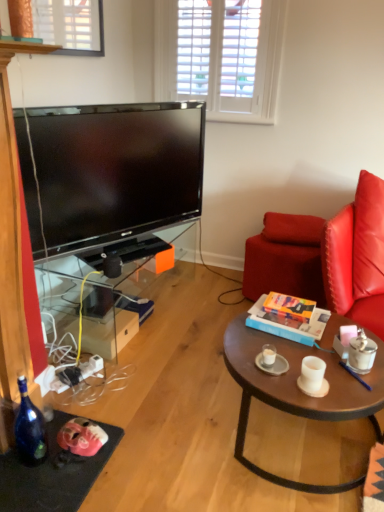
This screenshot has height=512, width=384. What do you see at coordinates (112, 265) in the screenshot?
I see `black matte speaker at lower left` at bounding box center [112, 265].

The image size is (384, 512). In order to click on black plastic pen at center in this screenshot , I will do `click(355, 375)`.

Image resolution: width=384 pixels, height=512 pixels. What do you see at coordinates (355, 375) in the screenshot?
I see `black plastic pen at center` at bounding box center [355, 375].

Image resolution: width=384 pixels, height=512 pixels. Find the location of `metallic silver coffee cup at right, placed as the 3th coffee cup when sorted from left to right`. metallic silver coffee cup at right, placed as the 3th coffee cup when sorted from left to right is located at coordinates (361, 354).

Measure the distance between leather swivel chair at right and camera.

leather swivel chair at right and camera are 7.50 feet apart.

This screenshot has height=512, width=384. What do you see at coordinates (285, 258) in the screenshot?
I see `leather swivel chair at right` at bounding box center [285, 258].

How much space does white matte coffee cup at center, acting as the 1th coffee cup starting from the left, occupy horizontally?

2.20 inches.

Find the location of a particular element. The height and width of the screenshot is (512, 384). white matte coffee cup at center, the third coffee cup positioned from the right is located at coordinates (269, 354).

The height and width of the screenshot is (512, 384). In order to click on transparent glass tv stand at left in this screenshot , I will do `click(107, 292)`.

Is white matte coffee cup at center, acting as the 1th coffee cup starting from the left, smaller than matte gray saucer at center?

Yes.

Based on the photo, is white matte coffee cup at center, the third coffee cup positioned from the right, facing towards matte gray saucer at center?

No, white matte coffee cup at center, the third coffee cup positioned from the right, does not turn towards matte gray saucer at center.

Are white matte coffee cup at center, the third coffee cup positioned from the right, and matte gray saucer at center making contact?

Yes, white matte coffee cup at center, the third coffee cup positioned from the right, and matte gray saucer at center clearly make contact.

Consider the image. Considering the relative sizes of brown wooden coffee table at center and leather swivel chair at right in the image provided, is brown wooden coffee table at center smaller than leather swivel chair at right?

Actually, brown wooden coffee table at center might be larger than leather swivel chair at right.

Where is `swivel chair located above the brown wooden coffee table at center (from the image's perspective)`? Image resolution: width=384 pixels, height=512 pixels. swivel chair located above the brown wooden coffee table at center (from the image's perspective) is located at coordinates (x=285, y=258).

Which is correct: brown wooden coffee table at center is inside leather swivel chair at right, or outside of it?

brown wooden coffee table at center exists outside the volume of leather swivel chair at right.

Is brown wooden coffee table at center wider than leather swivel chair at right?

Yes, brown wooden coffee table at center is wider than leather swivel chair at right.

How many degrees apart are the facing directions of matte gray saucer at center and hardcover book at center?

matte gray saucer at center and hardcover book at center are facing 6.83 degrees away from each other.

From the image's perspective, is matte gray saucer at center located above hardcover book at center?

No.

From a real-world perspective, between matte gray saucer at center and hardcover book at center, who is vertically higher?

hardcover book at center, from a real-world perspective.

Who is more distant, brown wooden coffee table at center or white matte coffee cup at center, the third coffee cup positioned from the right?

white matte coffee cup at center, the third coffee cup positioned from the right, is behind.

Looking at the image, does brown wooden coffee table at center seem bigger or smaller compared to white matte coffee cup at center, acting as the 1th coffee cup starting from the left?

brown wooden coffee table at center is bigger than white matte coffee cup at center, acting as the 1th coffee cup starting from the left.

Would you say brown wooden coffee table at center contains white matte coffee cup at center, acting as the 1th coffee cup starting from the left?

No, brown wooden coffee table at center does not contain white matte coffee cup at center, acting as the 1th coffee cup starting from the left.

Can you tell me how much white matte coffee cup at center right, the second coffee cup when ordered from left to right, and black plastic pen at center differ in facing direction?

white matte coffee cup at center right, the second coffee cup when ordered from left to right, and black plastic pen at center are facing 6.42 degrees away from each other.

Is white matte coffee cup at center right, placed as the 2th coffee cup when sorted from right to left, not close to black plastic pen at center?

No, white matte coffee cup at center right, placed as the 2th coffee cup when sorted from right to left, is in close proximity to black plastic pen at center.

Looking at their sizes, would you say white matte coffee cup at center right, the second coffee cup when ordered from left to right, is wider or thinner than black plastic pen at center?

Clearly, white matte coffee cup at center right, the second coffee cup when ordered from left to right, has less width compared to black plastic pen at center.

Which point is more distant from viewer, (314,371) or (367,388)?

The point (367,388) is behind.

Is the position of black plastic pen at center more distant than that of black matte speaker at lower left?

No, it is in front of black matte speaker at lower left.

Is black plastic pen at center turned away from black matte speaker at lower left?

That's not correct — black plastic pen at center is not looking away from black matte speaker at lower left.

Is there a large distance between black plastic pen at center and black matte speaker at lower left?

Yes, black plastic pen at center and black matte speaker at lower left are quite far apart.

Considering the points (305, 244) and (372, 361), which point is in front, point (305, 244) or point (372, 361)?

The point (372, 361) is closer to the camera.

Between leather swivel chair at right and metallic silver coffee cup at right, placed as the 3th coffee cup when sorted from left to right, which one has more height?

With more height is leather swivel chair at right.

From the image's perspective, who appears lower, leather swivel chair at right or metallic silver coffee cup at right, placed as the 3th coffee cup when sorted from left to right?

metallic silver coffee cup at right, placed as the 3th coffee cup when sorted from left to right, appears lower in the image.

Which of these two, leather swivel chair at right or metallic silver coffee cup at right, which ranks as the 1th coffee cup in right-to-left order, is smaller?

metallic silver coffee cup at right, which ranks as the 1th coffee cup in right-to-left order.

Where is `the 1st coffee cup above the matte gray saucer at center (from the image's perspective)`? This screenshot has width=384, height=512. the 1st coffee cup above the matte gray saucer at center (from the image's perspective) is located at coordinates (269, 354).

Locate an element on the screen. Image resolution: width=384 pixels, height=512 pixels. swivel chair on the right of brown wooden coffee table at center is located at coordinates (285, 258).

When comparing their distances from white matte coffee cup at center right, the second coffee cup when ordered from left to right, does matte gray saucer at center or brown wooden coffee table at center seem closer?

The object closer to white matte coffee cup at center right, the second coffee cup when ordered from left to right, is matte gray saucer at center.

Estimate the real-world distances between objects in this image. Which object is closer to white matte coffee cup at center right, placed as the 2th coffee cup when sorted from right to left, matte gray saucer at center or leather swivel chair at right?

Among the two, matte gray saucer at center is located nearer to white matte coffee cup at center right, placed as the 2th coffee cup when sorted from right to left.

Considering their positions, is transparent glass tv stand at left positioned further to leather swivel chair at right than white matte coffee cup at center right, the second coffee cup when ordered from left to right?

Among the two, white matte coffee cup at center right, the second coffee cup when ordered from left to right, is located further to leather swivel chair at right.

When comparing their distances from white matte coffee cup at center, the third coffee cup positioned from the right, does metallic silver coffee cup at right, which ranks as the 1th coffee cup in right-to-left order, or hardcover book at center seem closer?

The object closer to white matte coffee cup at center, the third coffee cup positioned from the right, is hardcover book at center.

In the scene shown: Looking at the image, which one is located further to white matte coffee cup at center right, placed as the 2th coffee cup when sorted from right to left, red leather pillow at right or leather swivel chair at right?

red leather pillow at right lies further to white matte coffee cup at center right, placed as the 2th coffee cup when sorted from right to left, than the other object.

Looking at the image, which one is located further to metallic silver coffee cup at right, which ranks as the 1th coffee cup in right-to-left order, leather swivel chair at right or black plastic pen at center?

leather swivel chair at right.

Which object lies further to the anchor point black plastic pen at center, hardcover book at center or black matte speaker at lower left?

black matte speaker at lower left lies further to black plastic pen at center than the other object.

From the image, which object appears to be farther from matte gray saucer at center, leather swivel chair at right or hardcover book at center?

leather swivel chair at right is further to matte gray saucer at center.

In order to click on speaker located between transparent glass tv stand at left and white matte coffee cup at center, acting as the 1th coffee cup starting from the left, in the left-right direction in this screenshot , I will do `click(112, 265)`.

Find the location of a particular element. coffee cup situated between transparent glass tv stand at left and matte gray saucer at center from left to right is located at coordinates (269, 354).

I want to click on saucer situated between transparent glass tv stand at left and hardcover book at center from left to right, so click(x=272, y=365).

Locate an element on the screen. box between black plastic pen at center and red leather pillow at right in the front-back direction is located at coordinates (288, 323).